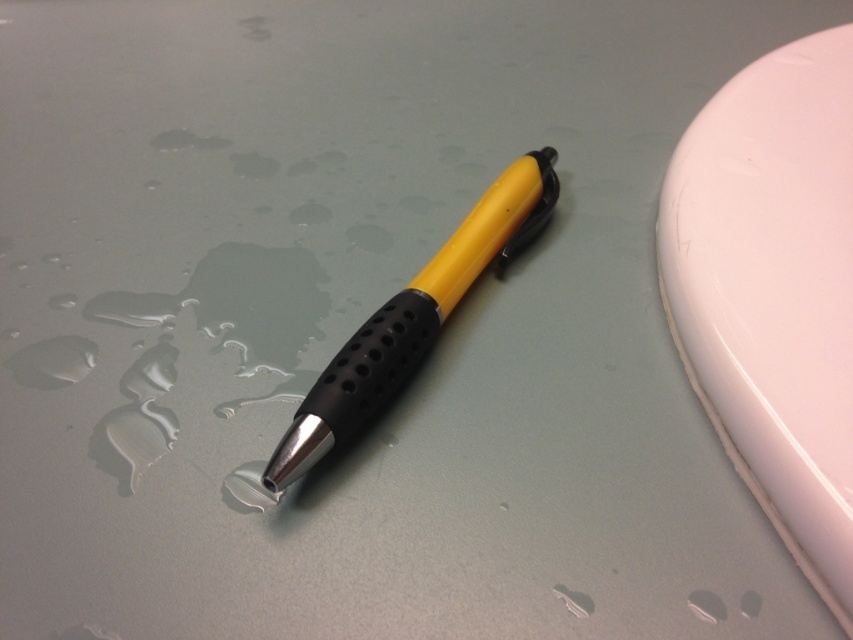
Is white glossy eraser at upper right wider than yellow matte pen at center?

No.

In the scene shown: Measure the distance between point (833, 148) and camera.

Point (833, 148) and camera are 1.39 meters apart.

Where is `white glossy eraser at upper right`? white glossy eraser at upper right is located at coordinates tap(773, 291).